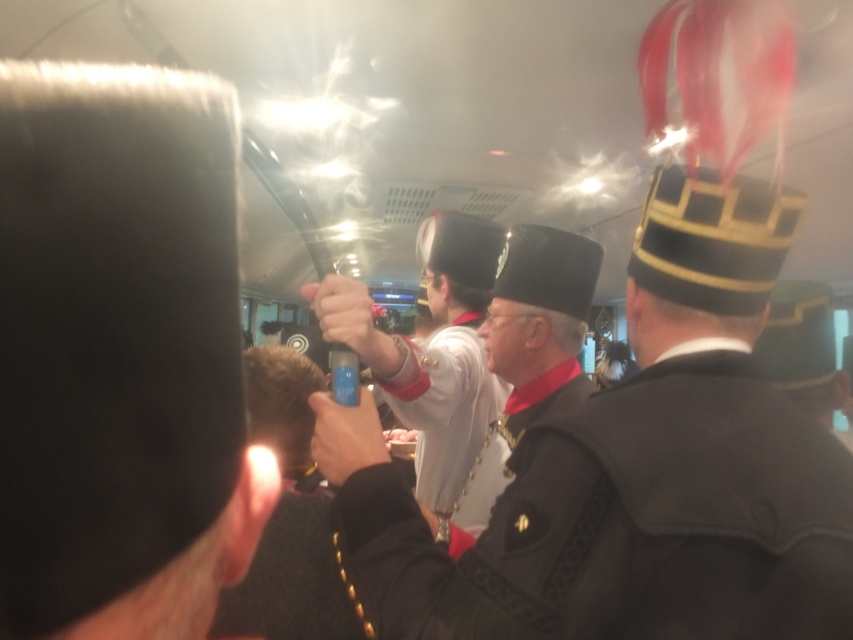
Is black felt hat at center wider than matte black hat at center?

No, black felt hat at center is not wider than matte black hat at center.

Does black felt hat at center appear on the left side of matte black hat at center?

In fact, black felt hat at center is to the right of matte black hat at center.

Who is more distant from viewer, [576,307] or [451,269]?

The point [451,269] is behind.

Locate an element on the screen. The height and width of the screenshot is (640, 853). black felt hat at center is located at coordinates (548, 269).

Is point (541, 262) closer to viewer compared to point (465, 372)?

Yes.

Who is taller, black matte uniform at center or white matte uniform at center?

Standing taller between the two is black matte uniform at center.

Between point (503, 468) and point (445, 419), which one is positioned behind?

Positioned behind is point (445, 419).

The image size is (853, 640). What are the coordinates of `black matte uniform at center` in the screenshot? It's located at (531, 348).

Between white matte uniform at center and black felt hat at center, which one appears on the right side from the viewer's perspective?

black felt hat at center

Between white matte uniform at center and black felt hat at center, which one has more height?

Standing taller between the two is white matte uniform at center.

Is point (397, 416) more distant than point (518, 291)?

No.

The width and height of the screenshot is (853, 640). I want to click on white matte uniform at center, so click(444, 404).